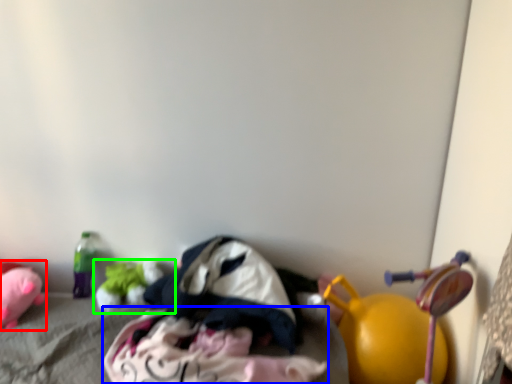
Question: Which object is positioned closest to toy (highlighted by a red box)? Select from clothing (highlighted by a blue box) and toy (highlighted by a green box).

Choices:
 (A) clothing
 (B) toy

Answer: (B)